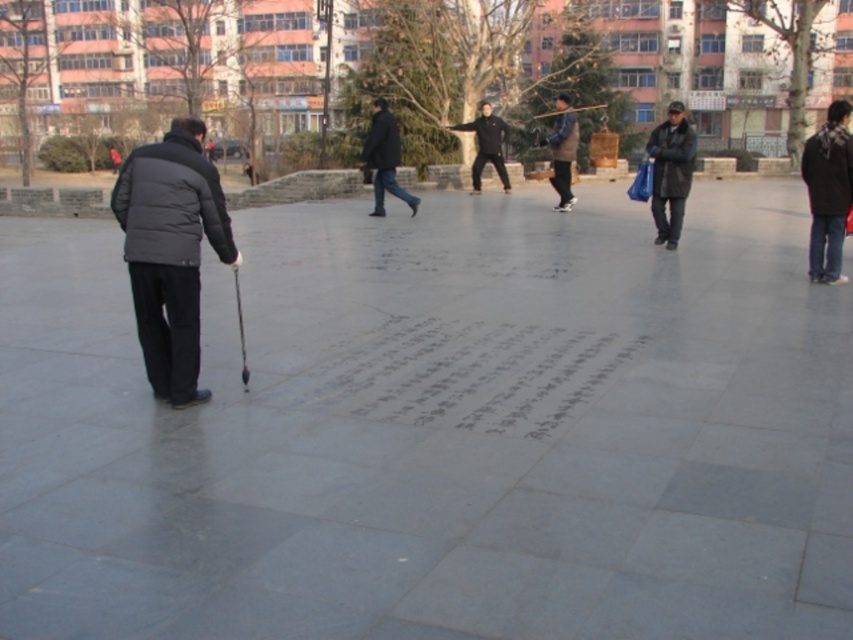
Question: Is dark brown leather jacket at right smaller than black matte jacket at center?

Choices:
 (A) no
 (B) yes

Answer: (A)

Question: Does dark gray matte jacket at left have a lesser width compared to black matte jacket at center?

Choices:
 (A) yes
 (B) no

Answer: (B)

Question: Is the position of dark gray matte jacket at left more distant than that of brown fuzzy coat at center?

Choices:
 (A) no
 (B) yes

Answer: (A)

Question: Considering the real-world distances, which object is farthest from the brown fuzzy coat at center?

Choices:
 (A) black matte jacket at center
 (B) dark brown leather jacket at right

Answer: (B)

Question: Which object appears closest to the camera in this image?

Choices:
 (A) black matte jacket at center
 (B) dark gray jacket at right
 (C) brown fuzzy coat at center
 (D) dark gray jacket at center

Answer: (B)

Question: Which point is closer to the camera?

Choices:
 (A) (665, 189)
 (B) (374, 209)
 (C) (807, 168)

Answer: (C)